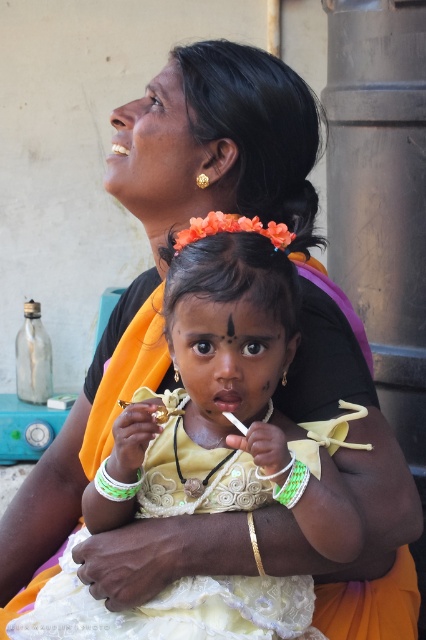
Question: Which object appears farthest from the camera in this image?

Choices:
 (A) white plastic bracelet at lower center
 (B) white lace dress at center

Answer: (A)

Question: Estimate the real-world distances between objects in this image. Which object is closer to the white lace dress at center?

Choices:
 (A) green fabric bracelet at lower center
 (B) white plastic bracelet at lower center
 (C) matte gold necklace at center
 (D) gold metallic bracelet at lower center

Answer: (D)

Question: Can you confirm if white plastic bracelet at lower center is wider than green woven bracelet at center?

Choices:
 (A) yes
 (B) no

Answer: (A)

Question: Which point is farther to the camera?

Choices:
 (A) green fabric bracelet at lower center
 (B) white lace dress at center

Answer: (B)

Question: Where is white lace dress at center located in relation to green woven bracelet at center in the image?

Choices:
 (A) left
 (B) right

Answer: (A)

Question: Is matte gold necklace at center closer to camera compared to gold metallic bracelet at lower center?

Choices:
 (A) yes
 (B) no

Answer: (A)